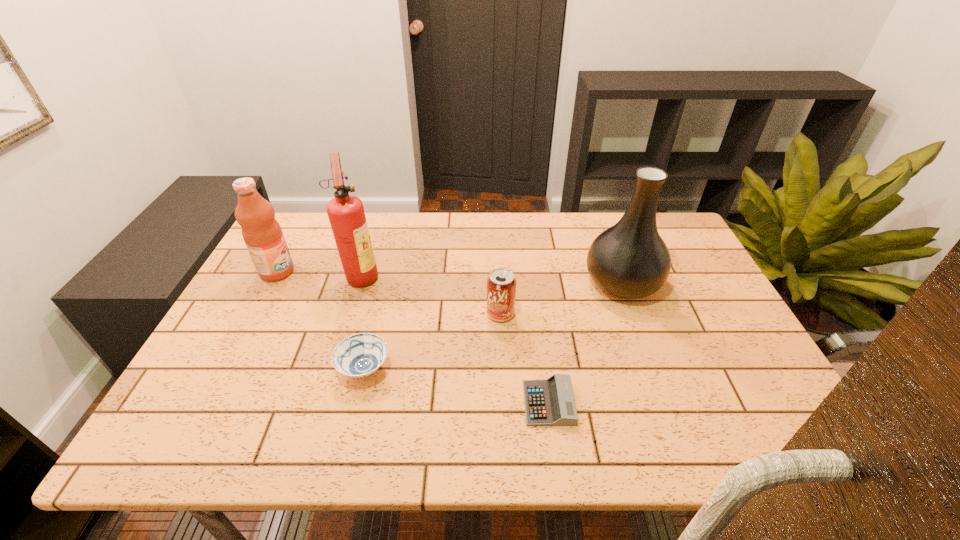
Find the location of a particular element. This screenshot has width=960, height=540. vacant space positioned 0.260m on the back of the rightmost object is located at coordinates (596, 212).

You are a GUI agent. You are given a task and a screenshot of the screen. Output one action in this format:
    pyautogui.click(x=<x>, y=<y>)
    Task: Click on the blank space located 0.290m on the front label of the leftmost object
    Image resolution: width=960 pixels, height=540 pixels.
    Given the screenshot: What is the action you would take?
    pyautogui.click(x=392, y=272)

Find the location of a particular element. Image resolution: width=960 pixels, height=540 pixels. free space located 0.150m on the right of the fourth object from left to right is located at coordinates (570, 314).

The height and width of the screenshot is (540, 960). I want to click on vacant point located 0.290m on the left of the second shortest object, so tap(214, 369).

At what (x,y) coordinates should I click in order to perform the action: click on vacant space located 0.260m on the right of the fifth object from left to right. Please return your answer as a coordinate pair (x, y). The height and width of the screenshot is (540, 960). Looking at the image, I should click on (691, 403).

Image resolution: width=960 pixels, height=540 pixels. I want to click on object positioned at the near edge, so click(x=549, y=402).

You are a GUI agent. You are given a task and a screenshot of the screen. Output one action in this format:
    pyautogui.click(x=<x>, y=<y>)
    Task: Click on the object present at the left edge
    
    Given the screenshot: What is the action you would take?
    pyautogui.click(x=262, y=233)

At what (x,y) coordinates should I click in order to perform the action: click on object present at the right edge. Please return your answer as a coordinate pair (x, y). Image resolution: width=960 pixels, height=540 pixels. Looking at the image, I should click on (630, 260).

Identify the location of free location at the far edge. Image resolution: width=960 pixels, height=540 pixels. (483, 248).

Locate an element on the screen. The width and height of the screenshot is (960, 540). vacant space at the near edge of the desktop is located at coordinates (552, 435).